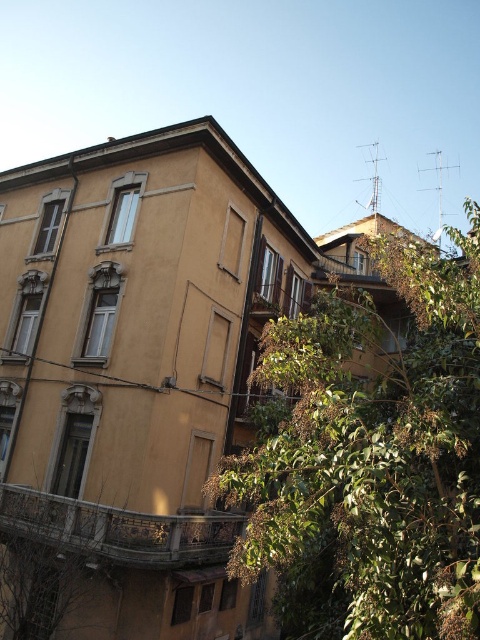
Question: Observing the image, what is the correct spatial positioning of green leafy tree at center in reference to stone textured balcony at lower left?

Choices:
 (A) right
 (B) left

Answer: (A)

Question: Considering the relative positions of green leafy tree at center and stone textured balcony at lower left in the image provided, where is green leafy tree at center located with respect to stone textured balcony at lower left?

Choices:
 (A) left
 (B) right

Answer: (B)

Question: Does green leafy tree at center appear over stone textured balcony at lower left?

Choices:
 (A) no
 (B) yes

Answer: (B)

Question: Which point is farther to the camera?

Choices:
 (A) stone textured balcony at lower left
 (B) green leafy tree at center

Answer: (A)